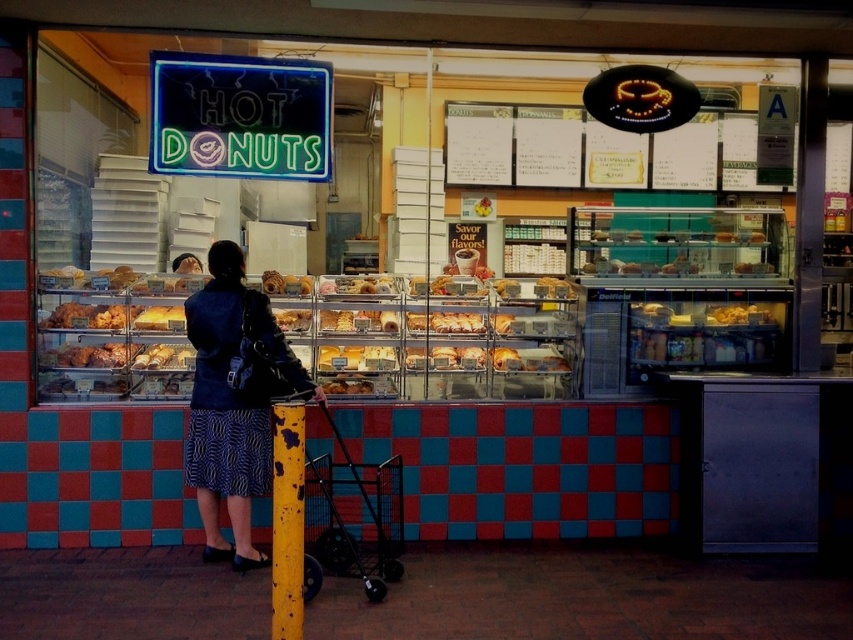
You are a parent pushing a black metal baby carriage at lower center and want to grab a yellow glazed pastry at center from the display case. Which direction should you move the carriage to reach the pastry?

The black metal baby carriage at lower center is to the right of the yellow glazed pastry at center, so you should move the carriage to the left to reach the pastry.

From the picture: You are a parent holding a baby and standing outside the bakery shop. You see a black metal baby carriage at lower center. Where should you place the baby carriage so it doesn not block the entrance? The entrance is located at the point with coordinates (344,524).

The entrance is located at the point with coordinates (344,524), so you should move the black metal baby carriage at lower center away from that location to avoid blocking the entrance.

You are a parent pushing a black metal baby carriage at lower center towards the bakery entrance. There is a yellow glazed pastry at center blocking your path. Can you maneuver around the pastry without hitting it?

The black metal baby carriage at lower center is wider than the yellow glazed pastry at center, so you can maneuver around the pastry without hitting it by moving to the side since the carriage is wider and has more space to navigate.